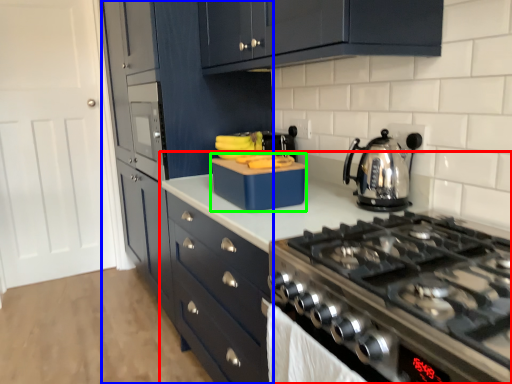
Question: Estimate the real-world distances between objects in this image. Which object is closer to countertop (highlighted by a red box), cabinetry (highlighted by a blue box) or kitchen appliance (highlighted by a green box)?

Choices:
 (A) cabinetry
 (B) kitchen appliance

Answer: (B)